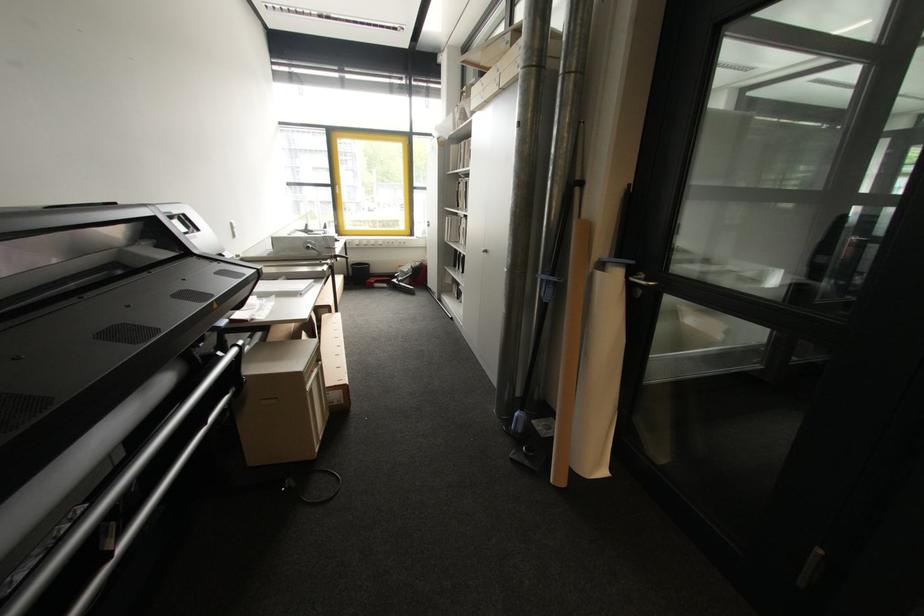
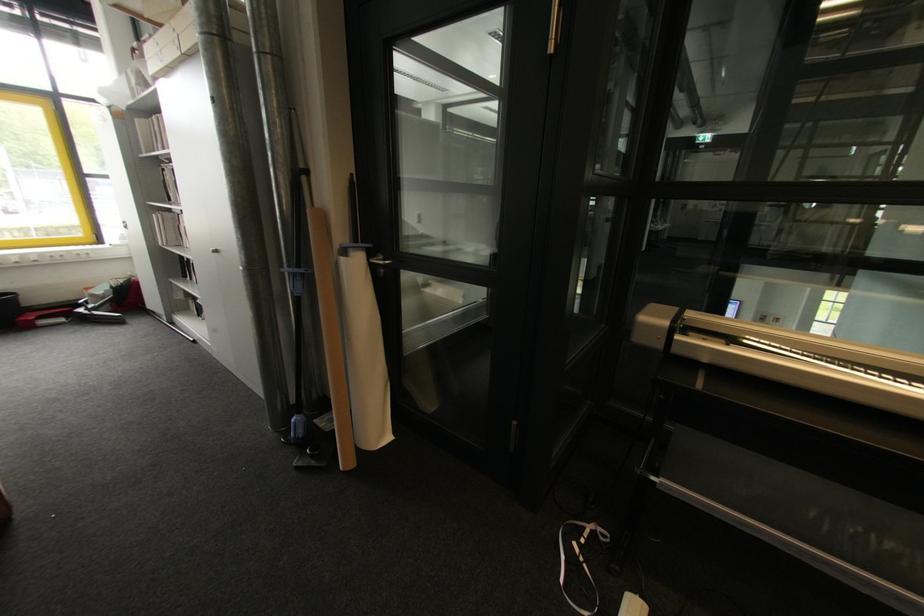
In the second image, find the point that corresponds to point (650, 282) in the first image.

(387, 261)